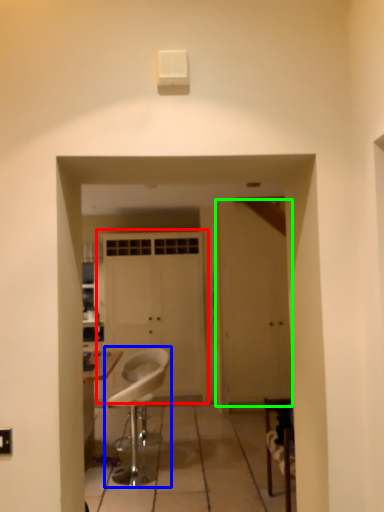
Question: Which object is the farthest from door (highlighted by a red box)? Choose among these: chair (highlighted by a blue box) or door (highlighted by a green box).

Choices:
 (A) chair
 (B) door

Answer: (A)